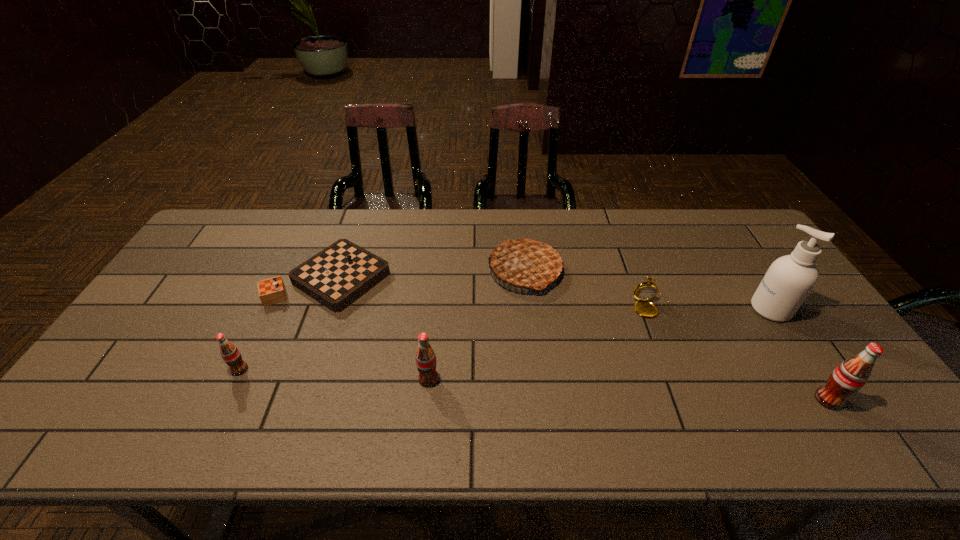
Locate an element on the screen. The width and height of the screenshot is (960, 540). pie present at the far edge is located at coordinates (525, 263).

This screenshot has height=540, width=960. Find the location of `chessboard located at the far edge`. chessboard located at the far edge is located at coordinates (337, 276).

The image size is (960, 540). What are the coordinates of `soda located at the right edge` in the screenshot? It's located at (850, 376).

Where is `cleansing agent positioned at the right edge`? The width and height of the screenshot is (960, 540). cleansing agent positioned at the right edge is located at coordinates (789, 280).

The height and width of the screenshot is (540, 960). I want to click on object at the near right corner, so click(850, 376).

This screenshot has height=540, width=960. In the image, there is a desktop. What are the coordinates of `free space at the far edge` in the screenshot? It's located at (425, 219).

You are a GUI agent. You are given a task and a screenshot of the screen. Output one action in this format:
    pyautogui.click(x=<x>, y=<y>)
    Task: Click on the vacant space at the near edge
    This screenshot has height=540, width=960.
    Given the screenshot: What is the action you would take?
    pyautogui.click(x=207, y=389)

Where is `vacant region at the right edge of the desktop`? The height and width of the screenshot is (540, 960). vacant region at the right edge of the desktop is located at coordinates (746, 259).

This screenshot has height=540, width=960. I want to click on free space at the far left corner of the desktop, so click(x=229, y=249).

Image resolution: width=960 pixels, height=540 pixels. Find the location of `free space at the near left corner of the desktop`. free space at the near left corner of the desktop is located at coordinates (133, 394).